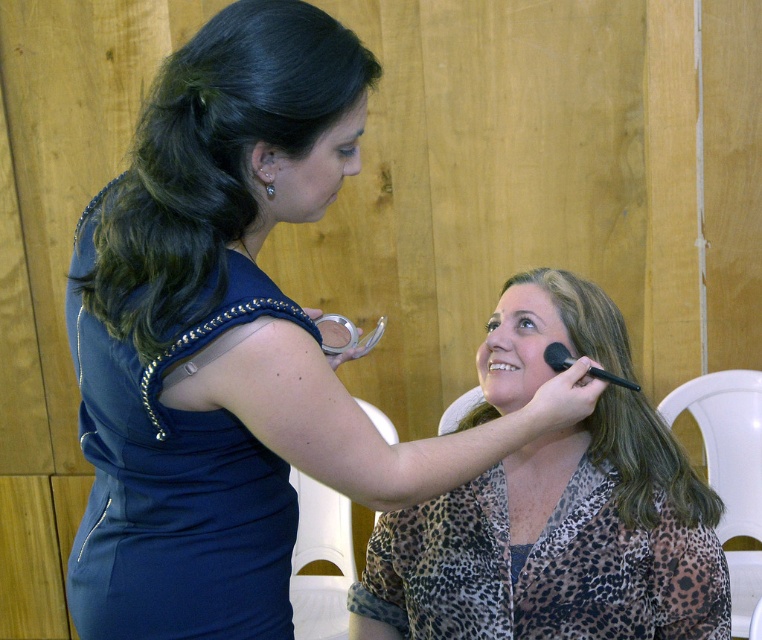
Question: Which is nearer to the pearl earrings at upper left?

Choices:
 (A) white plastic chair at lower right
 (B) dark blue silky hair at upper left
 (C) navy blue fabric dress at upper left

Answer: (B)

Question: Can you confirm if leopard print blouse at center is positioned below white plastic chair at right?

Choices:
 (A) yes
 (B) no

Answer: (B)

Question: Can you confirm if white plastic chair at lower right is positioned to the right of brown matte eyebrow at upper center?

Choices:
 (A) no
 (B) yes

Answer: (A)

Question: Which of the following is the closest to the observer?

Choices:
 (A) (530, 332)
 (B) (312, 528)
 (C) (522, 284)

Answer: (A)

Question: Does dark blue silky hair at upper left appear over matte black makeup brush at upper right?

Choices:
 (A) yes
 (B) no

Answer: (A)

Question: Which point is farther from the camera taking this photo?

Choices:
 (A) coord(181,344)
 (B) coord(312,589)
 (C) coord(684,502)

Answer: (B)